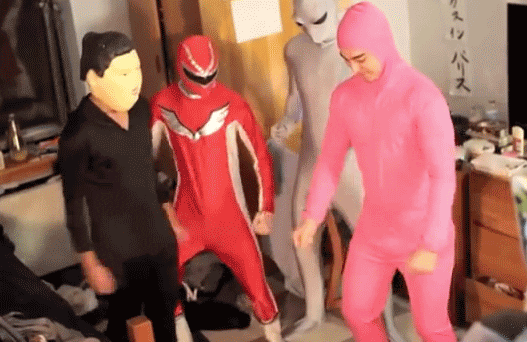
Locate an element on the screen. brown drawer is located at coordinates (515, 250).